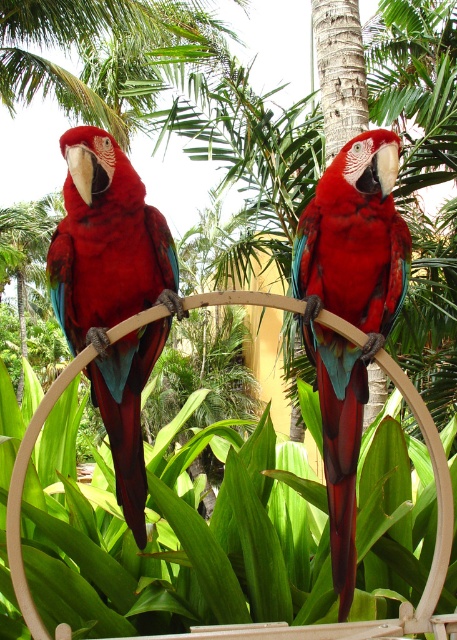
Is matte red parrot at left thinner than shiny red parrot at center?

No, matte red parrot at left is not thinner than shiny red parrot at center.

Which is in front, point (64, 292) or point (331, 538)?

Positioned in front is point (331, 538).

Is point (117, 424) positioned before point (307, 264)?

No.

Find the location of a particular element. This screenshot has height=640, width=457. matte red parrot at left is located at coordinates (112, 292).